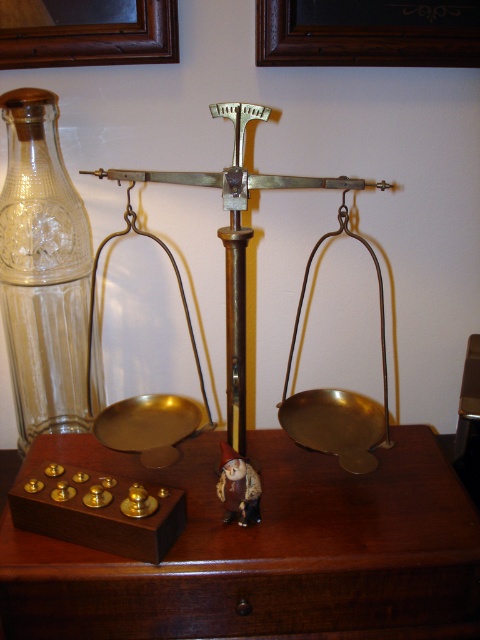
Is brass/bronze scale at center positioned before matte brown figurine at center?

Yes.

What do you see at coordinates (297, 310) in the screenshot? I see `brass/bronze scale at center` at bounding box center [297, 310].

You are a GUI agent. You are given a task and a screenshot of the screen. Output one action in this format:
    pyautogui.click(x=<x>, y=<y>)
    Task: Click on the brass/bronze scale at center
    The image size is (480, 640).
    Given the screenshot: What is the action you would take?
    pyautogui.click(x=297, y=310)

Who is taller, brown wooden picture frame at upper left or matte brown figurine at center?

matte brown figurine at center is taller.

Does point (21, 44) come farther from viewer compared to point (229, 461)?

Yes, it is.

Between point (162, 20) and point (228, 504), which one is positioned behind?

Positioned behind is point (162, 20).

Find the location of a particular element. The image size is (480, 640). brown wooden picture frame at upper left is located at coordinates (87, 35).

Does brown wooden table at center have a smaller size compared to wooden picture frame at upper center?

No, brown wooden table at center is not smaller than wooden picture frame at upper center.

Measure the distance between brown wooden table at center and camera.

brown wooden table at center and camera are 37.54 inches apart from each other.

At what (x,y) coordinates should I click in order to perform the action: click on brown wooden table at center. Please return your answer as a coordinate pair (x, y). Looking at the image, I should click on tap(262, 552).